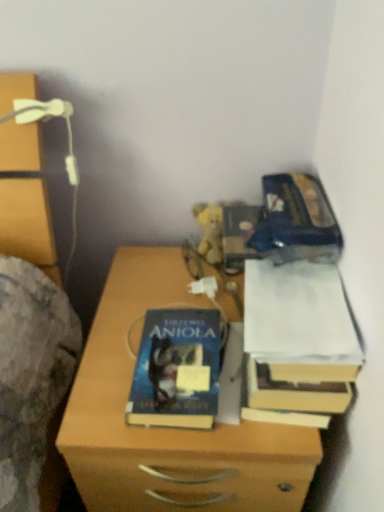
Question: Can you confirm if white paper at right is wider than hardcover book at center?

Choices:
 (A) yes
 (B) no

Answer: (A)

Question: Does white paper at right have a lesser height compared to hardcover book at center?

Choices:
 (A) no
 (B) yes

Answer: (B)

Question: From a real-world perspective, is white paper at right positioned under hardcover book at center based on gravity?

Choices:
 (A) no
 (B) yes

Answer: (A)

Question: Is hardcover book at center at the back of white paper at right?

Choices:
 (A) no
 (B) yes

Answer: (A)

Question: From a real-world perspective, is white paper at right on top of hardcover book at center?

Choices:
 (A) no
 (B) yes

Answer: (B)

Question: From the image's perspective, is white paper at right beneath hardcover book at center?

Choices:
 (A) yes
 (B) no

Answer: (B)

Question: Can you confirm if hardcover book at center is wider than white paper at right?

Choices:
 (A) no
 (B) yes

Answer: (A)

Question: From the image's perspective, is hardcover book at center on white paper at right?

Choices:
 (A) yes
 (B) no

Answer: (B)

Question: Can you confirm if hardcover book at center is thinner than white paper at right?

Choices:
 (A) no
 (B) yes

Answer: (B)

Question: Is hardcover book at center at the left side of white paper at right?

Choices:
 (A) no
 (B) yes

Answer: (B)

Question: Is white paper at right surrounded by hardcover book at center?

Choices:
 (A) no
 (B) yes

Answer: (A)

Question: Can you confirm if hardcover book at center is shorter than white paper at right?

Choices:
 (A) no
 (B) yes

Answer: (A)

Question: Considering the relative sizes of wooden chest of drawers at left and hardcover book at center in the image provided, is wooden chest of drawers at left wider than hardcover book at center?

Choices:
 (A) yes
 (B) no

Answer: (A)